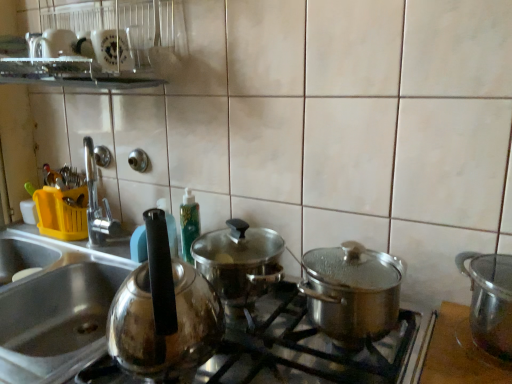
Question: Considering the relative sizes of shiny metallic pot at center, which is counted as the first kitchen appliance, starting from the left, and shiny metallic pot at right, the 2th kitchen appliance when ordered from left to right, in the image provided, is shiny metallic pot at center, which is counted as the first kitchen appliance, starting from the left, thinner than shiny metallic pot at right, the 2th kitchen appliance when ordered from left to right,?

Choices:
 (A) no
 (B) yes

Answer: (A)

Question: Can you confirm if shiny metallic pot at center, which is counted as the first kitchen appliance, starting from the left, is bigger than shiny metallic pot at right, which is the 1th kitchen appliance from right to left?

Choices:
 (A) no
 (B) yes

Answer: (B)

Question: Does shiny metallic pot at center, which is counted as the first kitchen appliance, starting from the left, come behind shiny metallic pot at right, the 2th kitchen appliance when ordered from left to right?

Choices:
 (A) no
 (B) yes

Answer: (A)

Question: From a real-world perspective, is shiny metallic pot at center, which is counted as the first kitchen appliance, starting from the left, positioned under shiny metallic pot at right, the 2th kitchen appliance when ordered from left to right, based on gravity?

Choices:
 (A) no
 (B) yes

Answer: (A)

Question: Is shiny metallic pot at center, which is counted as the first kitchen appliance, starting from the left, not near shiny metallic pot at right, the 2th kitchen appliance when ordered from left to right?

Choices:
 (A) yes
 (B) no

Answer: (B)

Question: Could you tell me if shiny metallic pot at center, which is counted as the first kitchen appliance, starting from the left, is facing shiny metallic pot at right, which is the 1th kitchen appliance from right to left?

Choices:
 (A) yes
 (B) no

Answer: (B)

Question: Considering the relative positions of shiny metallic pot at right, which is the 1th kitchen appliance from right to left, and shiny metallic pot at center, which is counted as the first kitchen appliance, starting from the left, in the image provided, is shiny metallic pot at right, which is the 1th kitchen appliance from right to left, behind shiny metallic pot at center, which is counted as the first kitchen appliance, starting from the left,?

Choices:
 (A) yes
 (B) no

Answer: (A)

Question: Considering the relative positions of shiny metallic pot at right, which is the 1th kitchen appliance from right to left, and shiny metallic pot at center, arranged as the 2th kitchen appliance when viewed from the right, in the image provided, is shiny metallic pot at right, which is the 1th kitchen appliance from right to left, in front of shiny metallic pot at center, arranged as the 2th kitchen appliance when viewed from the right,?

Choices:
 (A) no
 (B) yes

Answer: (A)

Question: Is shiny metallic pot at right, the 2th kitchen appliance when ordered from left to right, in contact with shiny metallic pot at center, arranged as the 2th kitchen appliance when viewed from the right?

Choices:
 (A) no
 (B) yes

Answer: (A)

Question: Can you confirm if shiny metallic pot at right, which is the 1th kitchen appliance from right to left, is taller than shiny metallic pot at center, which is counted as the first kitchen appliance, starting from the left?

Choices:
 (A) no
 (B) yes

Answer: (B)

Question: From a real-world perspective, is shiny metallic pot at right, which is the 1th kitchen appliance from right to left, located beneath shiny metallic pot at center, which is counted as the first kitchen appliance, starting from the left?

Choices:
 (A) yes
 (B) no

Answer: (A)

Question: Can you confirm if shiny metallic pot at right, the 2th kitchen appliance when ordered from left to right, is bigger than shiny metallic pot at center, arranged as the 2th kitchen appliance when viewed from the right?

Choices:
 (A) no
 (B) yes

Answer: (A)

Question: Is shiny metallic pots at center to the left of satin silver sink at left from the viewer's perspective?

Choices:
 (A) no
 (B) yes

Answer: (A)